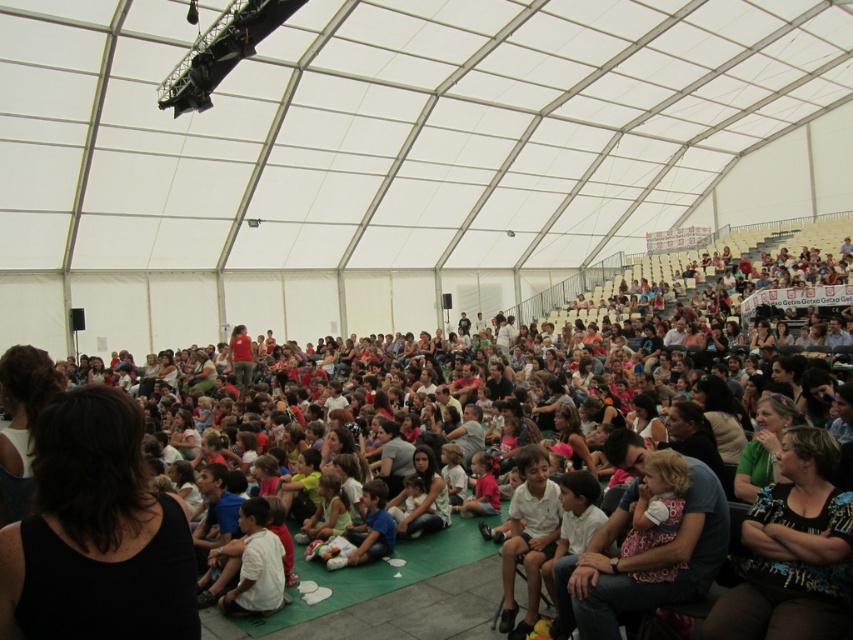
Question: Which object is positioned closest to the matte red shirt at center?

Choices:
 (A) dark brown hair at lower left
 (B) black printed shirt at lower right

Answer: (A)

Question: Is black printed shirt at lower right further to the viewer compared to pink fabric dress at center?

Choices:
 (A) no
 (B) yes

Answer: (A)

Question: Does black fabric at lower left come behind matte red shirt at center?

Choices:
 (A) no
 (B) yes

Answer: (A)

Question: Which point appears farthest from the camera in this image?

Choices:
 (A) (624, 524)
 (B) (489, 500)

Answer: (B)

Question: Among these objects, which one is farthest from the camera?

Choices:
 (A) black fabric at lower left
 (B) matte red shirt at center
 (C) matte black shirt at lower right

Answer: (B)

Question: Is pink fabric dress at center to the right of dark brown hair at lower left from the viewer's perspective?

Choices:
 (A) no
 (B) yes

Answer: (B)